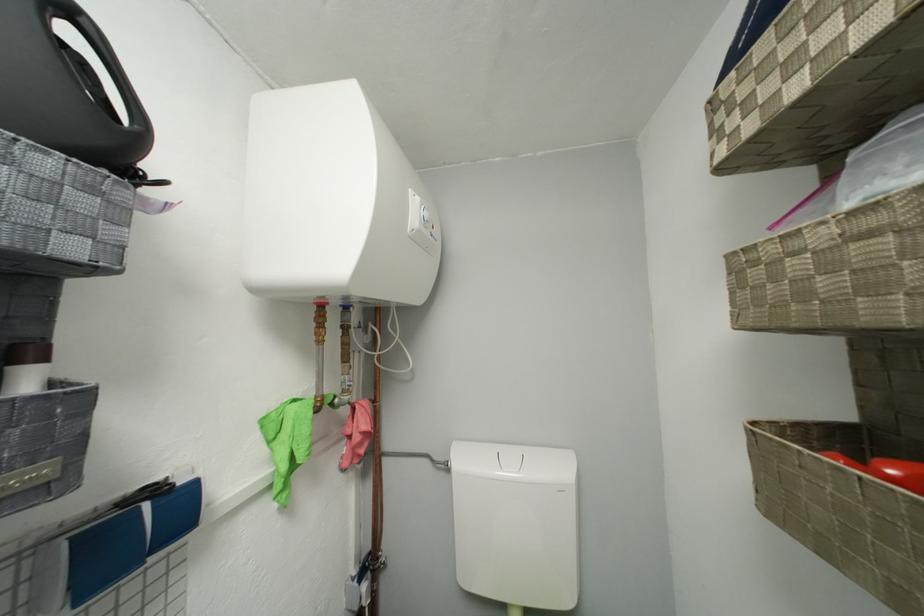
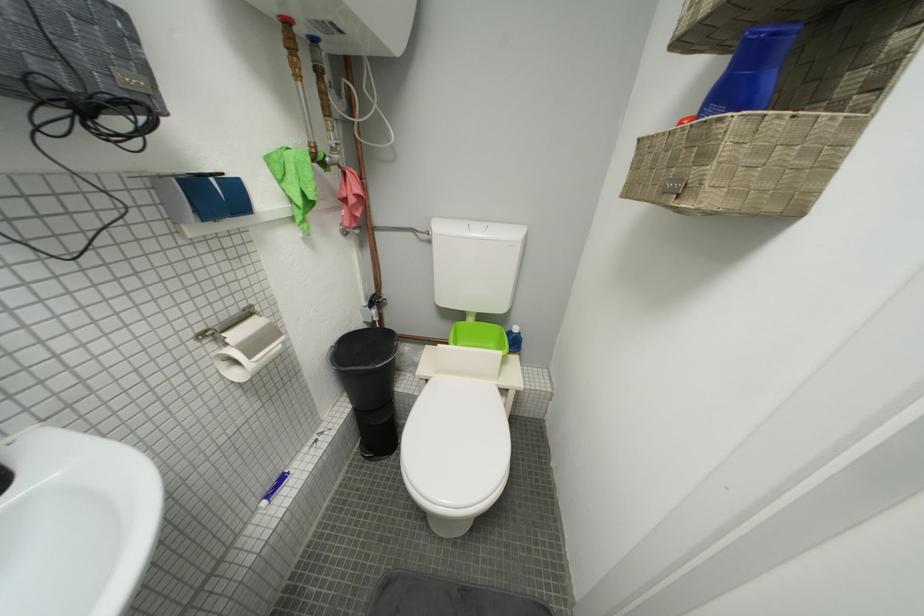
Question: Based on the continuous images, in which direction is the camera rotating? Reply with the corresponding letter.

Choices:
 (A) Left
 (B) Right
 (C) Up
 (D) Down

Answer: (D)